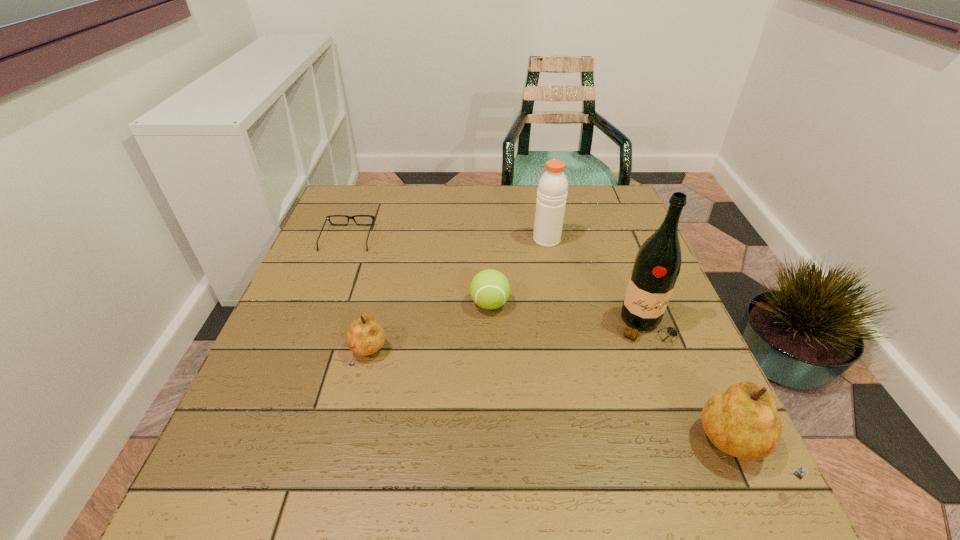
Locate an element on the screen. free space at the far right corner of the desktop is located at coordinates (603, 217).

In the image, there is a desktop. Where is `vacant space at the near right corner`? vacant space at the near right corner is located at coordinates (660, 410).

This screenshot has width=960, height=540. Find the location of `vacant space that's between the fourth object from right to left and the farther pear`. vacant space that's between the fourth object from right to left and the farther pear is located at coordinates (428, 329).

Where is `free space between the nearest object and the spectacles`? free space between the nearest object and the spectacles is located at coordinates (541, 344).

Where is `empty space between the tallest object and the shaker`? empty space between the tallest object and the shaker is located at coordinates (595, 282).

The image size is (960, 540). Identify the location of free space between the tennis ball and the shaker. (518, 272).

What are the coordinates of `vacant area between the shortest object and the nearest object` in the screenshot? It's located at (541, 344).

Where is `free point between the wine bottle and the taller pear`? free point between the wine bottle and the taller pear is located at coordinates (689, 388).

Identify the location of free spot between the spectacles and the shorter pear. (358, 296).

Locate an element on the screen. The image size is (960, 540). vacant area between the shortest object and the tennis ball is located at coordinates (419, 271).